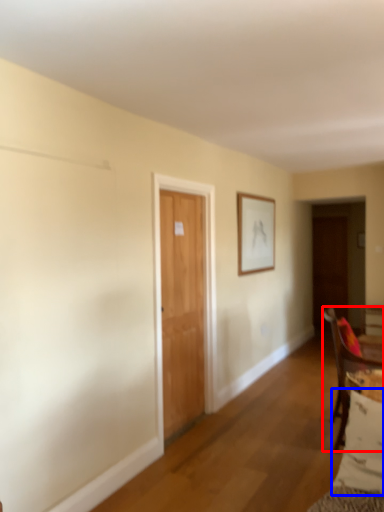
Question: Which object appears farthest to the camera in this image, chair (highlighted by a red box) or pillow (highlighted by a blue box)?

Choices:
 (A) chair
 (B) pillow

Answer: (A)